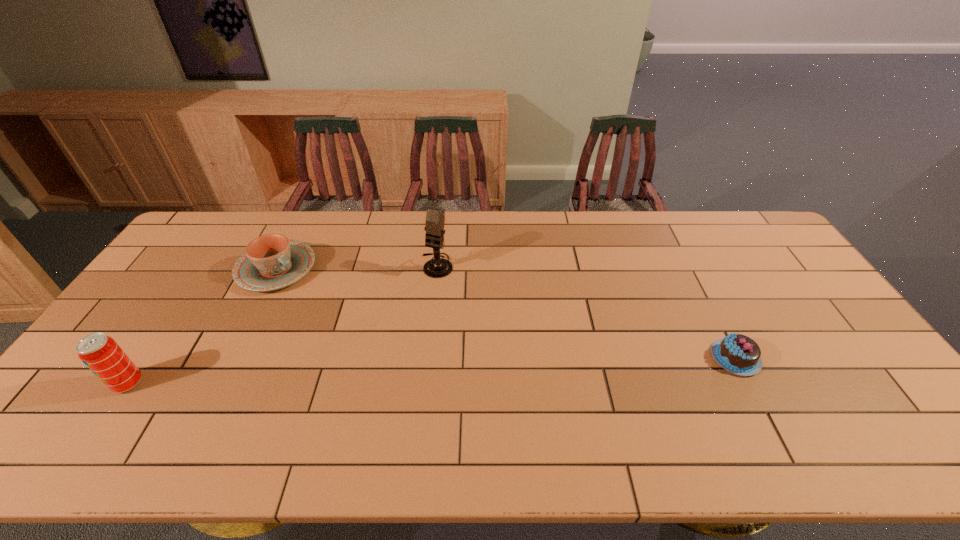
The height and width of the screenshot is (540, 960). I want to click on vacant area situated on the front-facing side of the tallest object, so click(x=413, y=308).

Identify the location of vacant area situated 0.200m on the front-facing side of the tallest object. Image resolution: width=960 pixels, height=540 pixels. (404, 323).

This screenshot has height=540, width=960. Find the location of `vacant area located on the front-facing side of the tallest object`. vacant area located on the front-facing side of the tallest object is located at coordinates (372, 380).

Locate an element on the screen. The image size is (960, 540). vacant space located on the handle side of the chinaware is located at coordinates (326, 303).

Image resolution: width=960 pixels, height=540 pixels. I want to click on vacant space located 0.270m on the handle side of the chinaware, so click(358, 325).

Locate an element on the screen. vacant space positioned 0.250m on the handle side of the chinaware is located at coordinates (353, 322).

This screenshot has width=960, height=540. Find the location of `object that is at the far edge`. object that is at the far edge is located at coordinates (272, 261).

The height and width of the screenshot is (540, 960). Identify the location of object present at the near edge. (101, 354).

Image resolution: width=960 pixels, height=540 pixels. Identify the location of object present at the left edge. (101, 354).

Locate an element on the screen. This screenshot has width=960, height=540. object at the near left corner is located at coordinates click(101, 354).